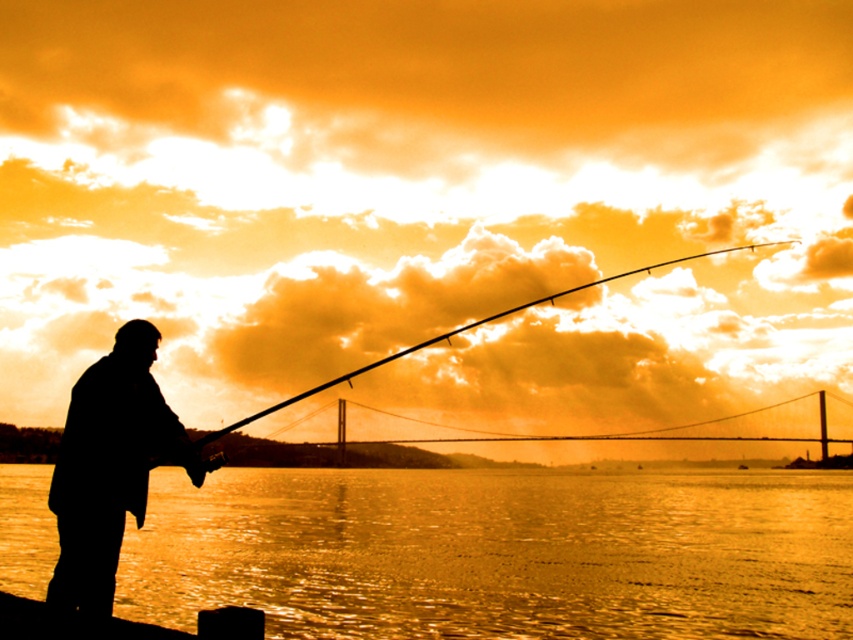
You are a photographer trying to capture the silhouette fishing rod at left and the smooth black rod at center in the same frame. Which rod is located to the left of the other?

The silhouette fishing rod at left is positioned on the left side of smooth black rod at center.